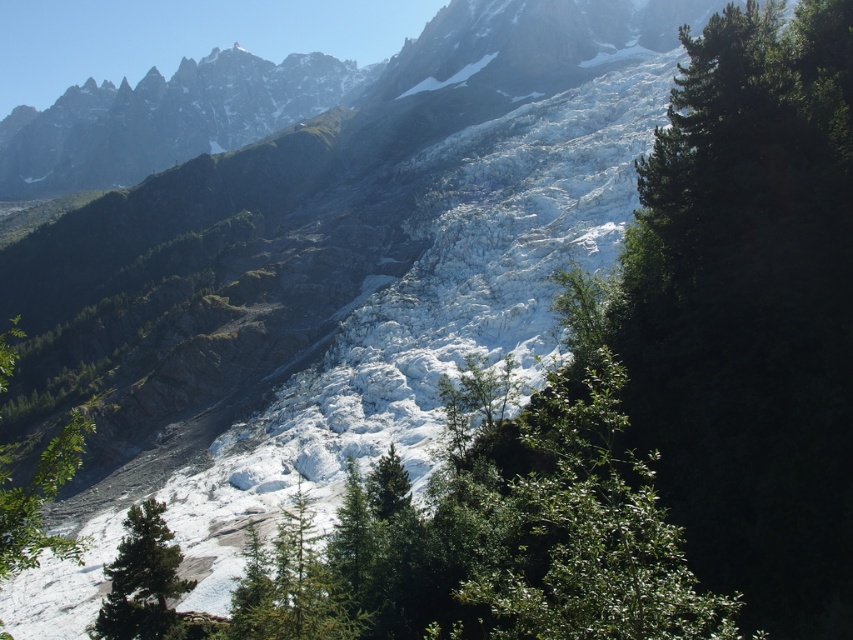
Question: Which of the following is the farthest from the observer?

Choices:
 (A) green matte tree at center
 (B) green matte tree at lower left
 (C) green leafy tree at left

Answer: (A)

Question: Is green needle-like tree at center above green matte tree at center?

Choices:
 (A) no
 (B) yes

Answer: (A)

Question: Is green matte tree at lower left to the right of green matte tree at center from the viewer's perspective?

Choices:
 (A) yes
 (B) no

Answer: (B)

Question: Which of the following is the closest to the observer?

Choices:
 (A) (300, 568)
 (B) (154, 627)
 (C) (381, 467)

Answer: (A)

Question: Is green needle-like tree at center to the right of green matte tree at center from the viewer's perspective?

Choices:
 (A) yes
 (B) no

Answer: (B)

Question: Among these points, which one is nearest to the camera?

Choices:
 (A) (305, 605)
 (B) (373, 496)

Answer: (A)